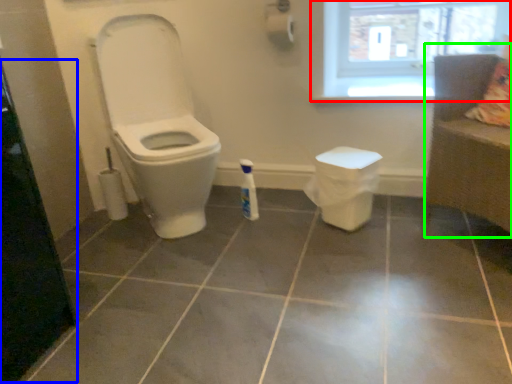
Question: Which object is positioned closest to window (highlighted by a red box)? Select from screen door (highlighted by a blue box) and couch (highlighted by a green box).

Choices:
 (A) screen door
 (B) couch

Answer: (B)